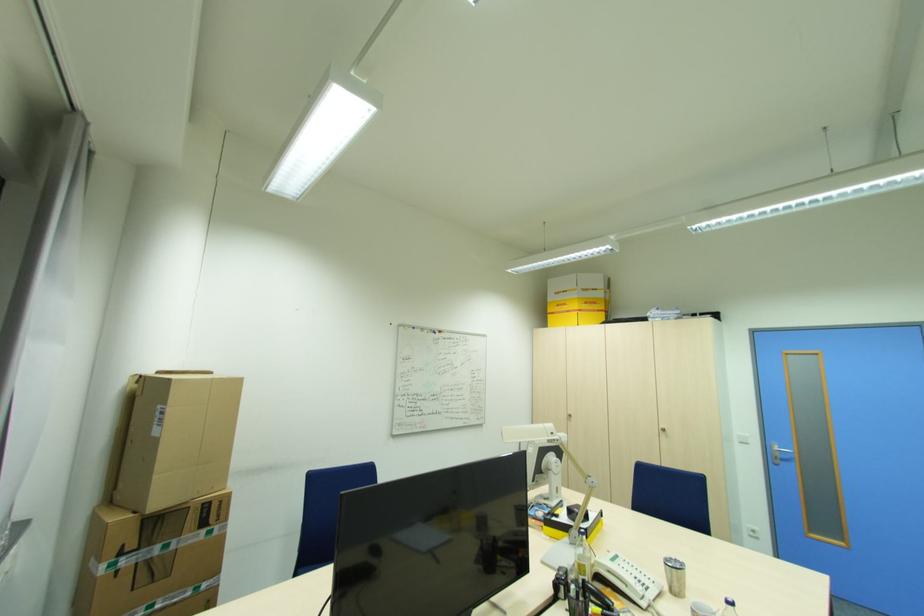
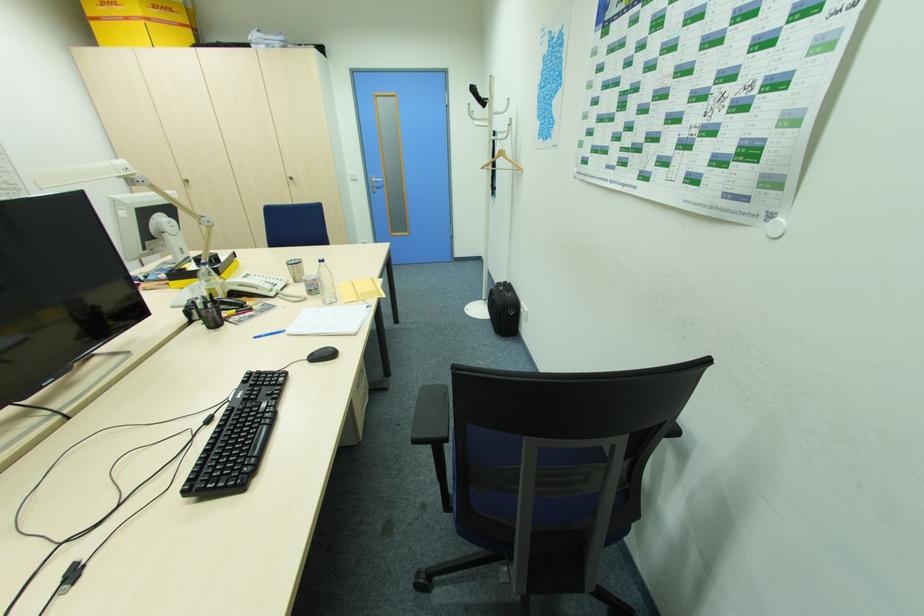
Based on the continuous images, in which direction is the camera rotating?

The camera rotated toward right-down.